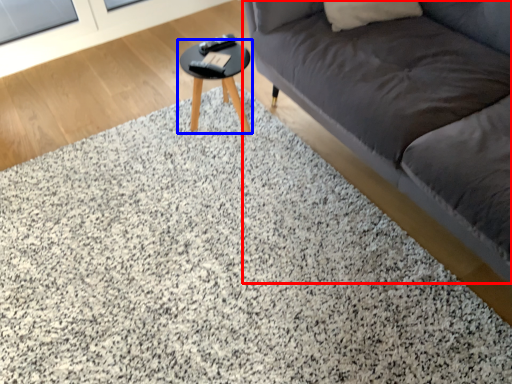
Question: Which point is closer to the camera, studio couch (highlighted by a red box) or table (highlighted by a blue box)?

Choices:
 (A) studio couch
 (B) table

Answer: (A)